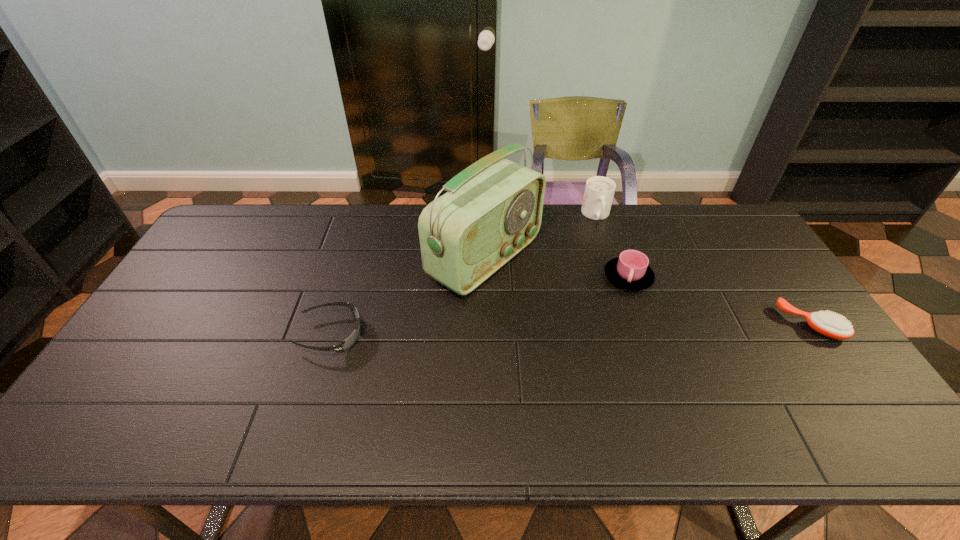
Where is `vacant space at the far edge of the desktop`? vacant space at the far edge of the desktop is located at coordinates pos(288,230).

Locate an element on the screen. free space at the near edge of the desktop is located at coordinates (550, 383).

Identify the location of free space at the left edge. (207, 278).

The image size is (960, 540). In the image, there is a desktop. Identify the location of vacant region at the right edge. (810, 374).

In the image, there is a desktop. Where is `free space at the far right corner`? The width and height of the screenshot is (960, 540). free space at the far right corner is located at coordinates (699, 214).

Locate an element on the screen. This screenshot has height=540, width=960. free space between the cup and the leftmost object is located at coordinates 479,306.

Find the location of a particular element. This screenshot has width=960, height=540. vacant area that lies between the rightmost object and the cappuccino is located at coordinates (704, 270).

Identify the location of vacant area between the fourth shortest object and the cup. Image resolution: width=960 pixels, height=540 pixels. (612, 247).

Find the location of a particular element. The height and width of the screenshot is (540, 960). free space between the hairbrush and the fourth object from right to left is located at coordinates (648, 291).

I want to click on free space between the cappuccino and the third shortest object, so click(x=612, y=247).